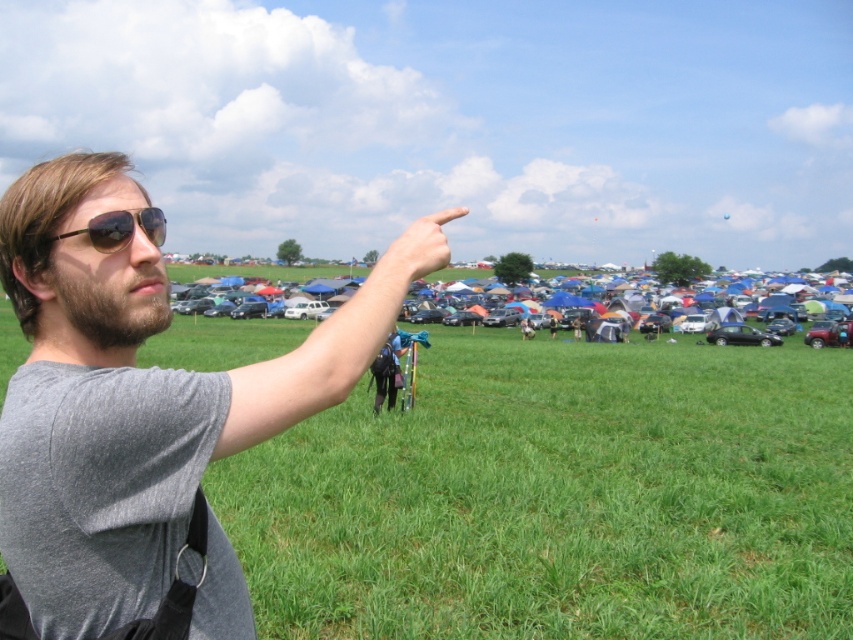
Question: Which point is farther to the camera?

Choices:
 (A) gray matte shirt at upper left
 (B) matte black sunglasses at upper left
 (C) metallic silver car at right
 (D) matte skin finger at upper center

Answer: (C)

Question: Is gray matte shirt at upper left below metallic silver car at right?

Choices:
 (A) no
 (B) yes

Answer: (A)

Question: Is matte skin finger at upper center below matte black sunglasses at upper left?

Choices:
 (A) yes
 (B) no

Answer: (B)

Question: Which object is the farthest from the metallic silver car at right?

Choices:
 (A) gray matte shirt at upper left
 (B) matte black sunglasses at upper left
 (C) matte skin finger at upper center
 (D) shiny metallic cars at center

Answer: (B)

Question: Does shiny metallic cars at center appear under matte black sunglasses at upper left?

Choices:
 (A) no
 (B) yes

Answer: (A)

Question: Which point is farther from the camera taking this photo?

Choices:
 (A) (74, 225)
 (B) (144, 224)

Answer: (B)